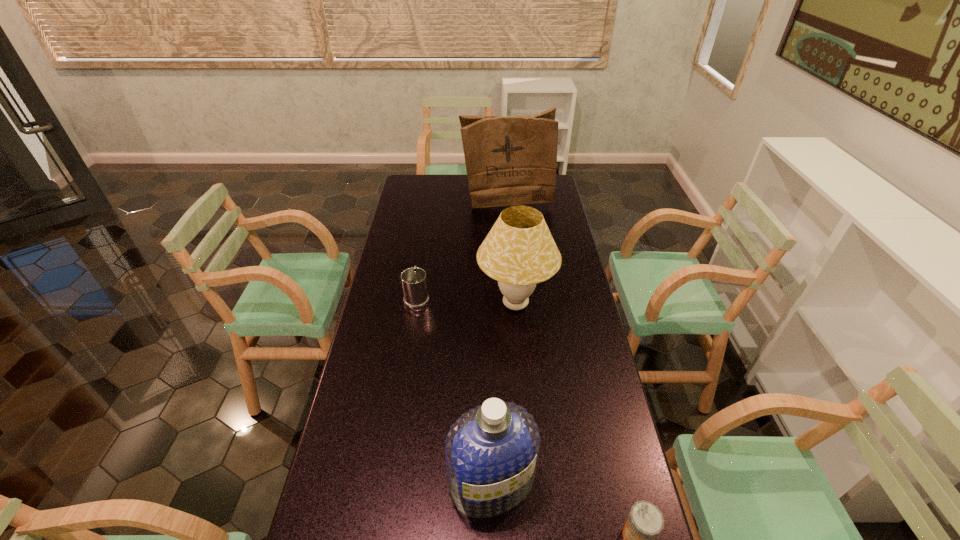
Locate an element on the screen. This screenshot has width=960, height=540. vacant space located on the side of the mug with the handle is located at coordinates (423, 258).

The width and height of the screenshot is (960, 540). What are the coordinates of `free spot located 0.300m on the side of the mug with the handle` in the screenshot? It's located at (426, 239).

This screenshot has height=540, width=960. What are the coordinates of `object that is at the far edge` in the screenshot? It's located at (x=509, y=160).

You are a GUI agent. You are given a task and a screenshot of the screen. Output one action in this format:
    pyautogui.click(x=<x>, y=<y>)
    Task: Click on the object that is at the left edge
    This screenshot has width=960, height=540.
    Given the screenshot: What is the action you would take?
    pyautogui.click(x=414, y=282)

You are a GUI agent. You are given a task and a screenshot of the screen. Output one action in this format:
    pyautogui.click(x=<x>, y=<y>)
    Task: Click on the grocery bag that is at the right edge
    This screenshot has width=960, height=540.
    Given the screenshot: What is the action you would take?
    pyautogui.click(x=509, y=160)

Locate an element on the screen. Image resolution: width=960 pixels, height=540 pixels. lampshade at the right edge is located at coordinates point(519,251).

This screenshot has width=960, height=540. What are the coordinates of `object that is at the far right corner` in the screenshot? It's located at (509, 160).

In the image, there is a desktop. Identify the location of vacant space at the left edge. The height and width of the screenshot is (540, 960). (369, 424).

Image resolution: width=960 pixels, height=540 pixels. In the image, there is a desktop. In order to click on free space at the right edge in this screenshot , I will do `click(561, 393)`.

Where is `free point at the far left corner`? This screenshot has width=960, height=540. free point at the far left corner is located at coordinates (413, 194).